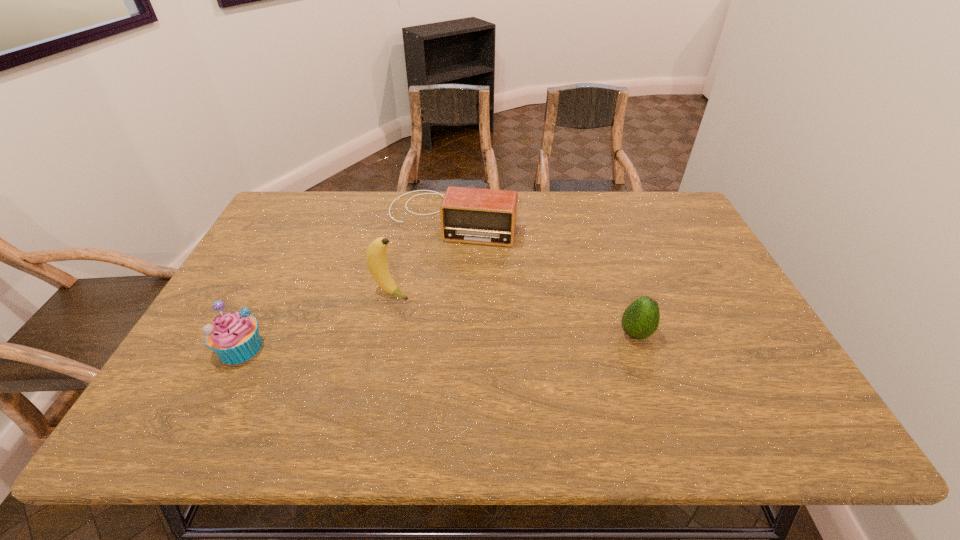
The width and height of the screenshot is (960, 540). I want to click on free spot on the desktop that is between the leftmost object and the rightmost object and is positioned from the stem of the tallest object, so [x=499, y=339].

Image resolution: width=960 pixels, height=540 pixels. What are the coordinates of `vacant space on the desktop that is between the leftmost object and the avocado and is positioned on the front-facing side of the radio receiver` in the screenshot? It's located at (410, 342).